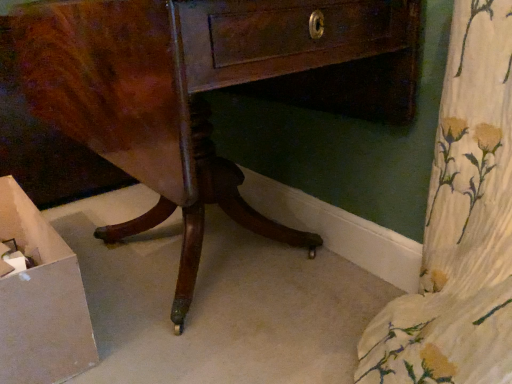
The height and width of the screenshot is (384, 512). What do you see at coordinates (203, 89) in the screenshot?
I see `shiny brown wood desk at center` at bounding box center [203, 89].

The height and width of the screenshot is (384, 512). Identify the location of shiny brown wood desk at center. (203, 89).

At what (x,y) coordinates should I click in order to perform the action: click on shiny brown wood desk at center. Please return your answer as a coordinate pair (x, y). This screenshot has width=512, height=384. Looking at the image, I should click on (203, 89).